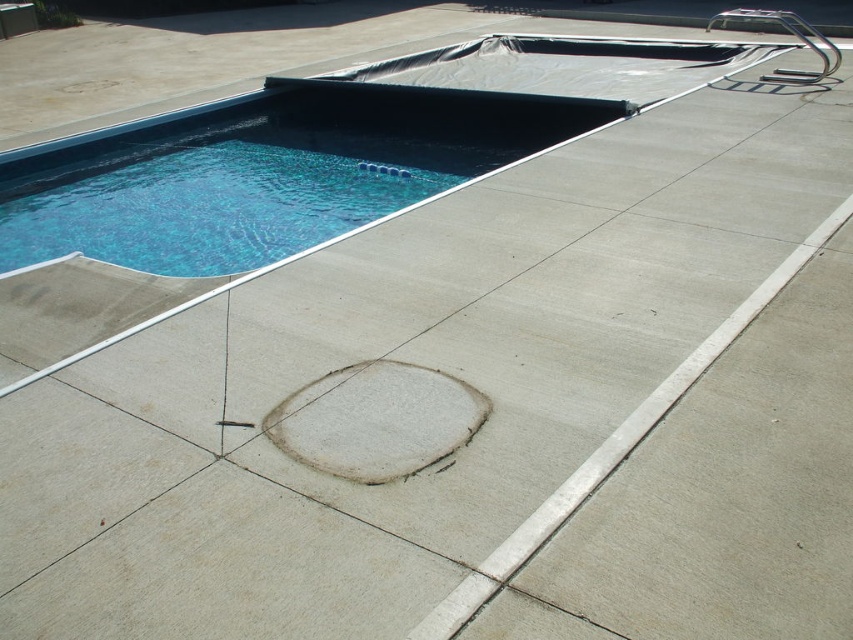
Based on the photo, you are standing on the concrete pool deck and want to walk from the blue smooth pool at upper left to the polished stainless steel ladder at upper right. Which direction should you move?

You should move to the right to reach the polished stainless steel ladder at upper right from the blue smooth pool at upper left since the blue smooth pool at upper left is to the left of the ladder.

You are designing a safety plan for the pool area. The blue smooth pool at upper left and the polished stainless steel ladder at upper right are both in the pool area. Which object has a greater width, and why is this important for safety?

The blue smooth pool at upper left has a greater width than the polished stainless steel ladder at upper right. This is important for safety because a wider pool might require more space for safety barriers or signage to prevent accidental falls or ensure proper access points.